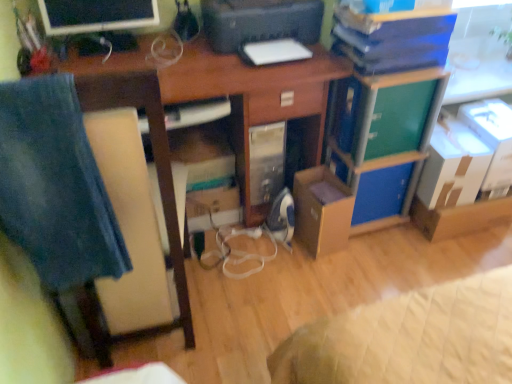
What are the coordinates of `empty space that is ontop of wooden desk at center (from a real-world perspective)` in the screenshot? It's located at pos(175,56).